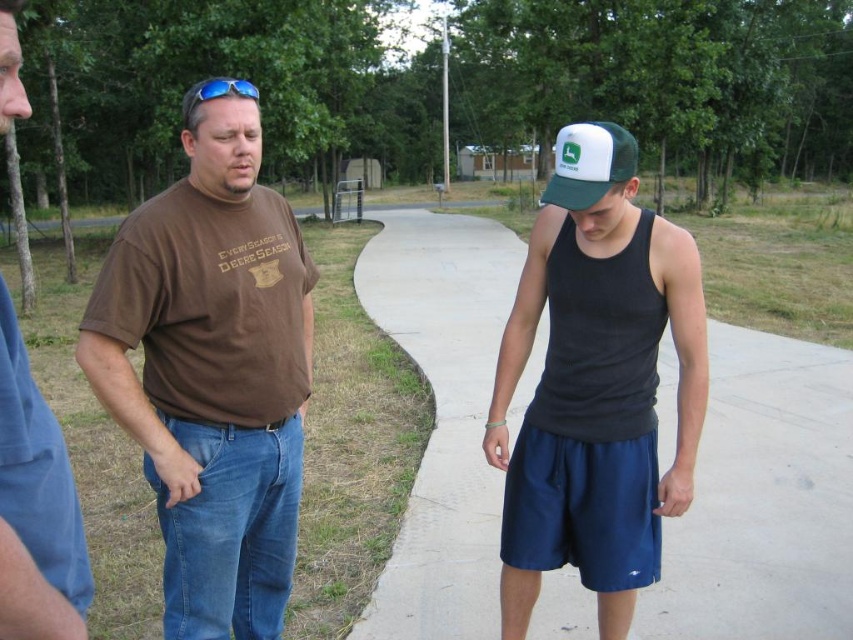
You are standing at the point closer to the camera between the two points, point 1 at (659, 429) and point 2 at (618, 138). If you turn to face the direction where the man in the brown T shirt is standing, will you be facing towards the right or left side of the image?

Since you are at the point closer to the camera, which is point 1 at (659, 429), and the man in the brown T shirt is in the center of the image, turning to face him would mean turning towards the left side of the image.